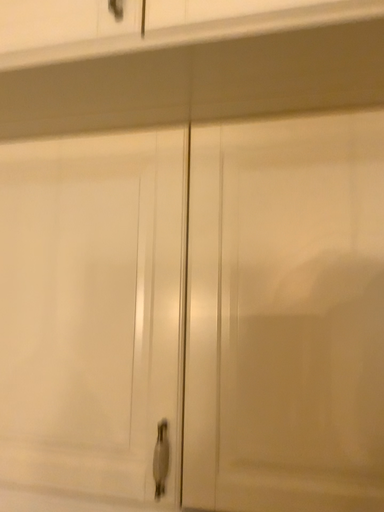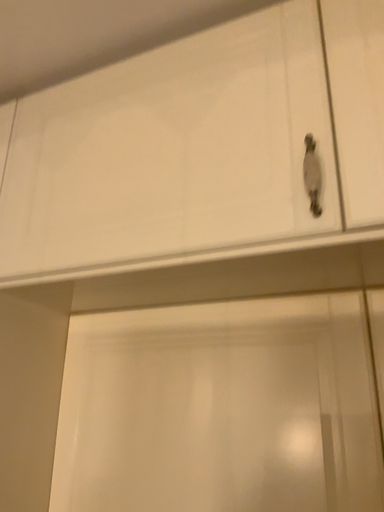
Question: How did the camera likely rotate when shooting the video?

Choices:
 (A) rotated right
 (B) rotated left

Answer: (B)